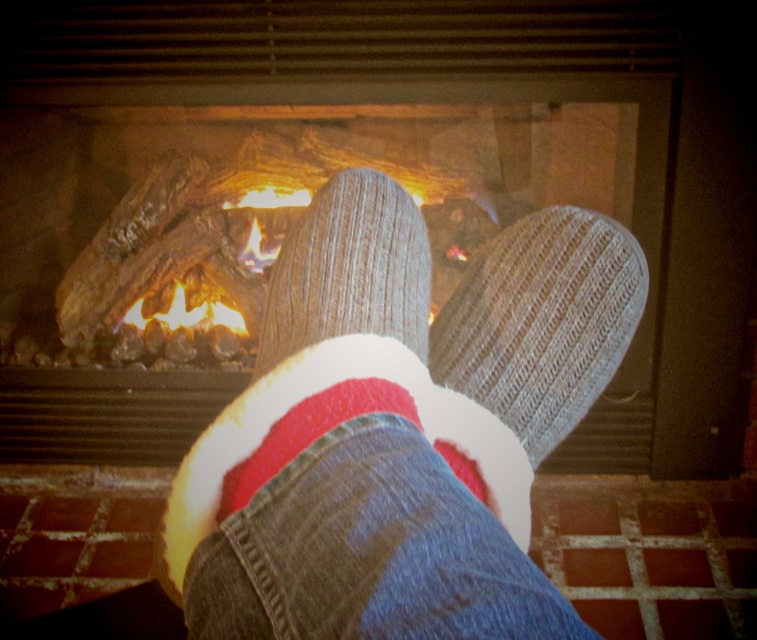
Does knitted socks at center appear over white fleece sock at center?

Indeed, knitted socks at center is positioned over white fleece sock at center.

Between point (441, 566) and point (276, 400), which one is positioned in front?

Point (441, 566)

The height and width of the screenshot is (640, 757). In order to click on knitted socks at center in this screenshot , I will do [x=388, y=433].

Is point (301, 266) more distant than point (279, 385)?

Yes, point (301, 266) is behind point (279, 385).

Is knit socks at center thinner than white fleece sock at center?

Correct, knit socks at center's width is less than white fleece sock at center's.

This screenshot has width=757, height=640. I want to click on knit socks at center, so click(x=347, y=269).

Is wooden logs at center wider than knitted socks at center?

Yes.

Between wooden logs at center and knitted socks at center, which one has less height?

knitted socks at center is shorter.

You are a GUI agent. You are given a task and a screenshot of the screen. Output one action in this format:
    pyautogui.click(x=<x>, y=<y>)
    Task: Click on the wooden logs at center
    
    Given the screenshot: What is the action you would take?
    pyautogui.click(x=419, y=154)